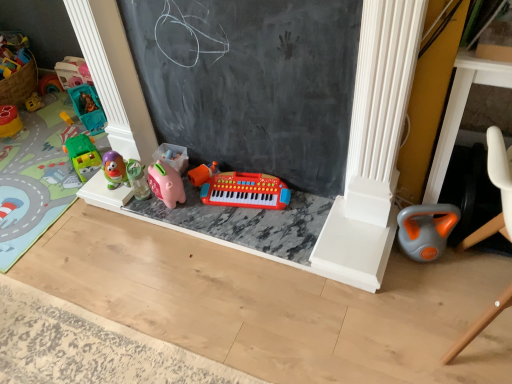
You are a GUI agent. You are given a task and a screenshot of the screen. Output one action in this format:
    pyautogui.click(x=<x>, y=<y>)
    Task: Click on the vacant region in front of rubberized green car at left, which ranks as the first toy in left-to-right order
    
    Given the screenshot: What is the action you would take?
    pyautogui.click(x=14, y=143)